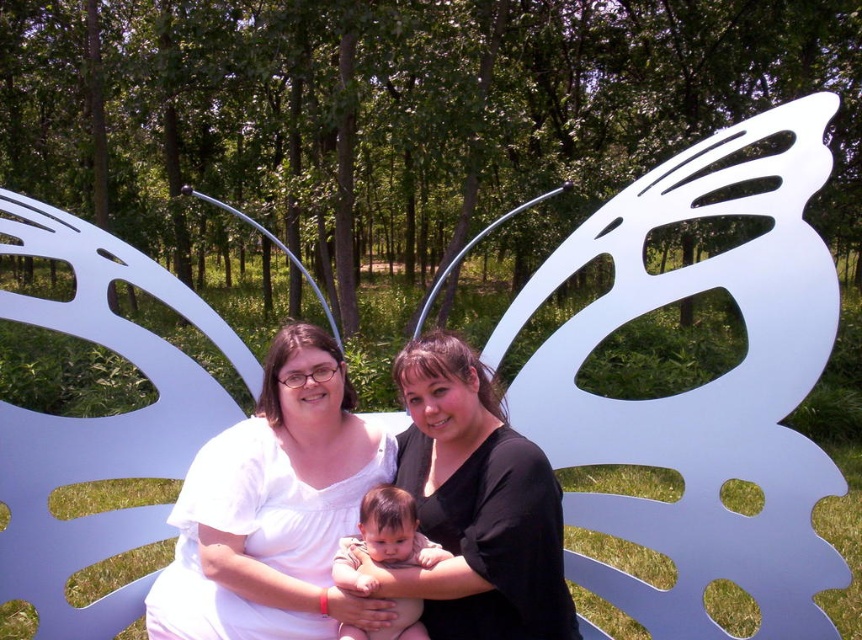
Question: Among these points, which one is farthest from the camera?

Choices:
 (A) (186, 586)
 (B) (404, 435)
 (C) (413, 557)

Answer: (B)

Question: Is white matte shirt at center wider than smooth skin baby at center?

Choices:
 (A) no
 (B) yes

Answer: (B)

Question: In this image, where is white matte shirt at center located relative to black matte shirt at center?

Choices:
 (A) below
 (B) above

Answer: (A)

Question: Is white matte shirt at center above smooth skin baby at center?

Choices:
 (A) no
 (B) yes

Answer: (B)

Question: Estimate the real-world distances between objects in this image. Which object is farther from the white matte shirt at center?

Choices:
 (A) black matte shirt at center
 (B) smooth skin baby at center

Answer: (A)

Question: Among these objects, which one is nearest to the camera?

Choices:
 (A) white matte shirt at center
 (B) black matte shirt at center

Answer: (B)